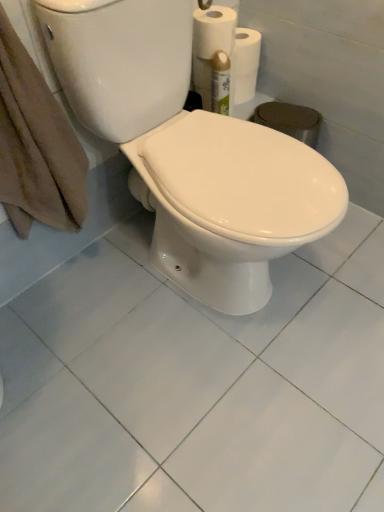
Find the location of a particular element. The height and width of the screenshot is (512, 384). vacant region to the left of white glossy toilet at center is located at coordinates (78, 334).